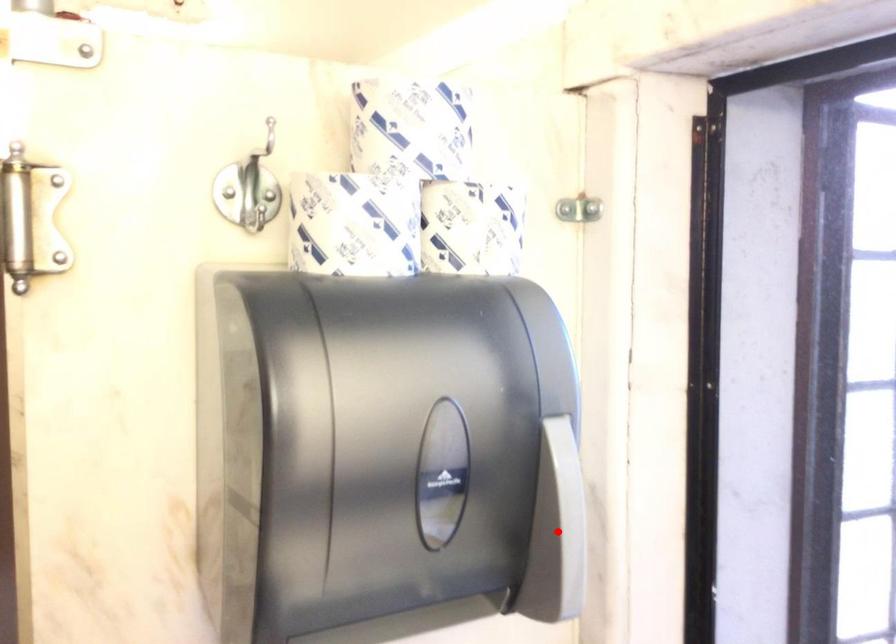
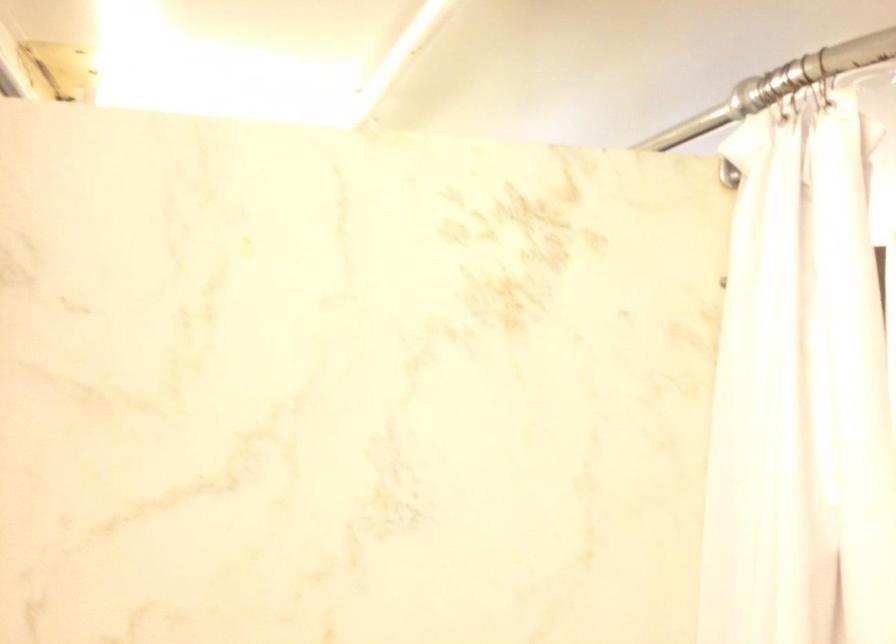
Question: I am providing you with two images of the same scene from different viewpoints. A red point is marked on the first image. Is the red point's position out of view in image 2?

Choices:
 (A) Yes
 (B) No

Answer: (A)